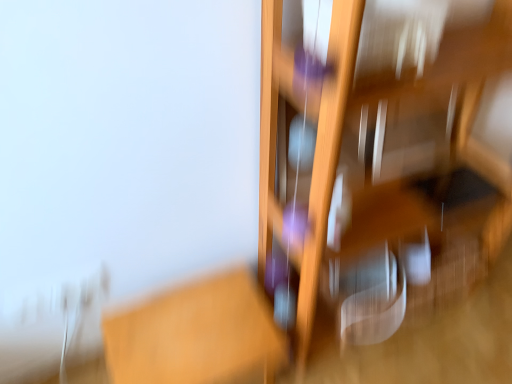
What is the approximate height of wooden table at center?

It is 10.53 inches.

The height and width of the screenshot is (384, 512). What do you see at coordinates (197, 335) in the screenshot? I see `wooden table at center` at bounding box center [197, 335].

Where is `wooden table at center`? This screenshot has width=512, height=384. wooden table at center is located at coordinates (197, 335).

Describe the element at coordinates (380, 178) in the screenshot. I see `wooden shelf at right` at that location.

Image resolution: width=512 pixels, height=384 pixels. I want to click on wooden shelf at right, so click(380, 178).

In order to click on wooden table at center in this screenshot , I will do `click(197, 335)`.

Does wooden shelf at right appear on the right side of wooden table at center?

Yes.

Is wooden shelf at right behind wooden table at center?

No, it is not.

Does point (275, 144) appear closer or farther from the camera than point (245, 268)?

Point (275, 144) is closer to the camera than point (245, 268).

From the image's perspective, is wooden shelf at right on top of wooden table at center?

Correct, wooden shelf at right appears higher than wooden table at center in the image.

From a real-world perspective, is wooden shelf at right physically below wooden table at center?

Incorrect, from a real-world perspective, wooden shelf at right is higher than wooden table at center.

Which object is thinner, wooden shelf at right or wooden table at center?

wooden table at center.

Is wooden shelf at right shorter than wooden table at center?

In fact, wooden shelf at right may be taller than wooden table at center.

Considering the relative sizes of wooden shelf at right and wooden table at center in the image provided, is wooden shelf at right bigger than wooden table at center?

Indeed, wooden shelf at right has a larger size compared to wooden table at center.

Is wooden shelf at right inside the boundaries of wooden table at center, or outside?

wooden shelf at right is not inside wooden table at center, it's outside.

Is wooden shelf at right far from wooden table at center?

No.

From the picture: Is wooden shelf at right oriented towards wooden table at center?

No, wooden shelf at right does not turn towards wooden table at center.

What's the angular difference between wooden shelf at right and wooden table at center's facing directions?

They differ by 1.09 degrees in their facing directions.

How distant is wooden shelf at right from wooden table at center?

A distance of 36.82 centimeters exists between wooden shelf at right and wooden table at center.

Where is `table on the left of wooden shelf at right`? The height and width of the screenshot is (384, 512). table on the left of wooden shelf at right is located at coordinates (197, 335).

Based on their positions, is wooden table at center located to the left or right of wooden shelf at right?

Based on their positions, wooden table at center is located to the left of wooden shelf at right.

Is wooden table at center closer to the viewer compared to wooden shelf at right?

No, wooden table at center is further to the viewer.

Based on the photo, which is farther, (283,360) or (278,178)?

Point (278,178)

From the image's perspective, between wooden table at center and wooden shelf at right, who is located below?

wooden table at center appears lower in the image.

From a real-world perspective, is wooden table at center on top of wooden shelf at right?

No.

Considering the sizes of objects wooden table at center and wooden shelf at right in the image provided, who is wider, wooden table at center or wooden shelf at right?

wooden shelf at right is wider.

Who is shorter, wooden table at center or wooden shelf at right?

Standing shorter between the two is wooden table at center.

Considering the sizes of objects wooden table at center and wooden shelf at right in the image provided, who is bigger, wooden table at center or wooden shelf at right?

Bigger between the two is wooden shelf at right.

Is wooden table at center not within wooden shelf at right?

Yes, wooden table at center is outside of wooden shelf at right.

Would you say wooden table at center is a long distance from wooden shelf at right?

wooden table at center is near wooden shelf at right, not far away.

Is wooden table at center facing away from wooden shelf at right?

No.

What's the angular difference between wooden table at center and wooden shelf at right's facing directions?

1.09 degrees separate the facing orientations of wooden table at center and wooden shelf at right.

Measure the distance from wooden table at center to wooden shelf at right.

wooden table at center is 14.50 inches from wooden shelf at right.

The height and width of the screenshot is (384, 512). In the image, there is a wooden shelf at right. Find the location of `table below it (from a real-world perspective)`. table below it (from a real-world perspective) is located at coordinates (197, 335).

Image resolution: width=512 pixels, height=384 pixels. What are the coordinates of `furniture that appears above the wooden table at center (from a real-world perspective)` in the screenshot? It's located at (380, 178).

Find the location of a particular element. table that appears below the wooden shelf at right (from the image's perspective) is located at coordinates (197, 335).